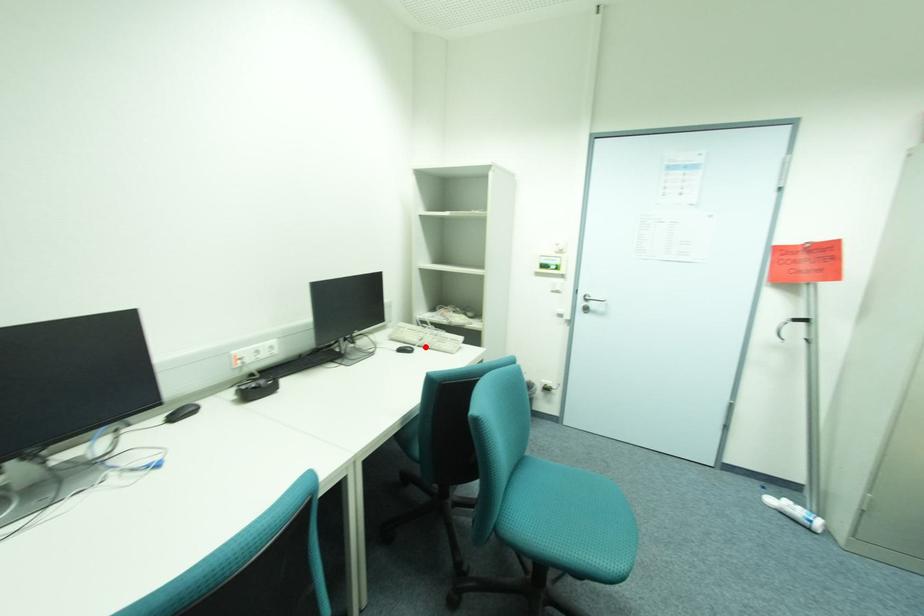
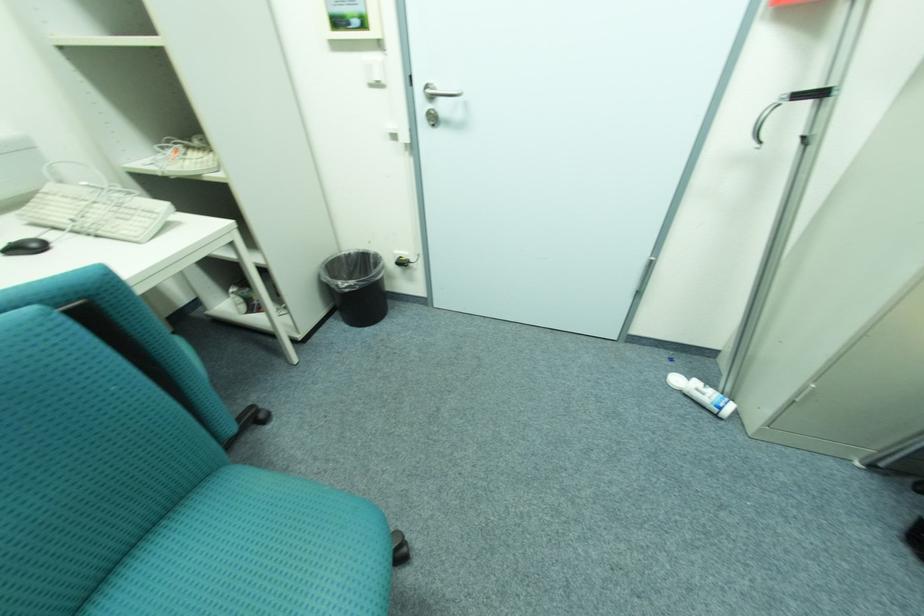
Where in the second image is the point corresponding to the highlighted location from the first image?

(81, 233)